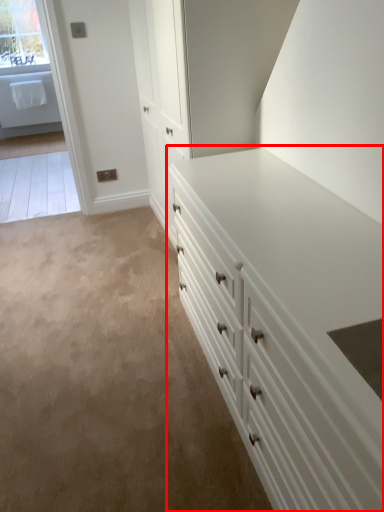
Question: Where is chest of drawers (annotated by the red box) located in relation to window in the image?

Choices:
 (A) left
 (B) right

Answer: (B)